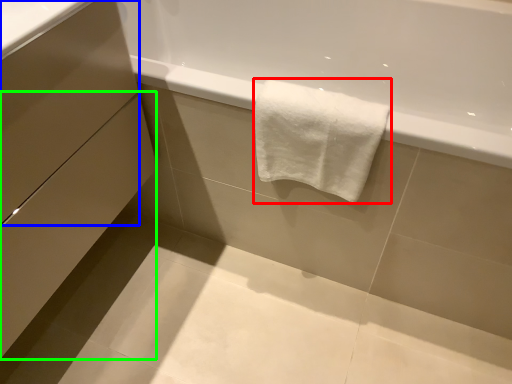
Question: Which is nearer to the towel (highlighted by a red box)? drawer (highlighted by a blue box) or drawer (highlighted by a green box).

Choices:
 (A) drawer
 (B) drawer

Answer: (A)